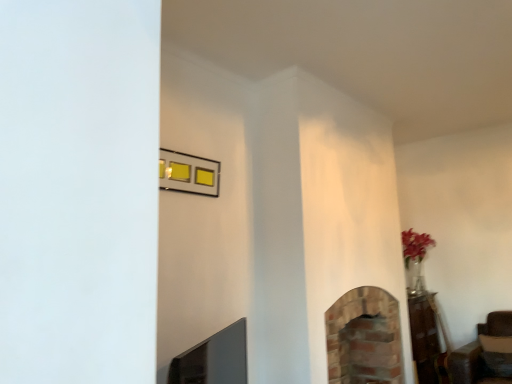
Find the location of a particular element. This screenshot has width=512, height=384. brick fireplace at center, which is the 1th fireplace from right to left is located at coordinates (364, 338).

Is brick fireplace at lower center, the first fireplace when ordered from left to right, further to camera compared to metallic gold picture frame at upper center?

That is False.

From a real-world perspective, which is physically above, brick fireplace at lower center, the second fireplace viewed from the right, or metallic gold picture frame at upper center?

From a 3D spatial view, metallic gold picture frame at upper center is above.

Is brick fireplace at lower center, the first fireplace when ordered from left to right, looking in the opposite direction of metallic gold picture frame at upper center?

brick fireplace at lower center, the first fireplace when ordered from left to right, is not turned away from metallic gold picture frame at upper center.

Which is farther, (177, 357) or (217, 171)?

The point (177, 357) is more distant.

What are the coordinates of `fireplace directly beneath the brick fireplace at lower center, positioned as the 2th fireplace in back-to-front order (from a real-world perspective)` in the screenshot? It's located at (364, 338).

Is brick fireplace at lower center, positioned as the 2th fireplace in back-to-front order, to the left or to the right of brick fireplace at center, the second fireplace in the left-to-right sequence, in the image?

brick fireplace at lower center, positioned as the 2th fireplace in back-to-front order, is positioned on brick fireplace at center, the second fireplace in the left-to-right sequence,'s left side.

Who is more distant, brick fireplace at lower center, the second fireplace viewed from the right, or brick fireplace at center, which appears as the 2th fireplace when viewed from the front?

brick fireplace at center, which appears as the 2th fireplace when viewed from the front.

From the picture: Who is bigger, brick fireplace at lower center, marked as the first fireplace in a front-to-back arrangement, or brick fireplace at center, the second fireplace in the left-to-right sequence?

With larger size is brick fireplace at center, the second fireplace in the left-to-right sequence.

Choose the correct answer: Is metallic gold picture frame at upper center inside brick fireplace at lower center, the first fireplace when ordered from left to right, or outside it?

metallic gold picture frame at upper center lies outside brick fireplace at lower center, the first fireplace when ordered from left to right.

Where is `fireplace lying in front of the metallic gold picture frame at upper center`? The width and height of the screenshot is (512, 384). fireplace lying in front of the metallic gold picture frame at upper center is located at coordinates (214, 359).

Can you confirm if metallic gold picture frame at upper center is positioned to the left of brick fireplace at lower center, positioned as the 2th fireplace in back-to-front order?

Indeed, metallic gold picture frame at upper center is positioned on the left side of brick fireplace at lower center, positioned as the 2th fireplace in back-to-front order.

In terms of height, does metallic gold picture frame at upper center look taller or shorter compared to brick fireplace at lower center, positioned as the 2th fireplace in back-to-front order?

Clearly, metallic gold picture frame at upper center is shorter compared to brick fireplace at lower center, positioned as the 2th fireplace in back-to-front order.

Can you tell me how much brick fireplace at center, the 1th fireplace viewed from the back, and metallic gold picture frame at upper center differ in facing direction?

There is a 0.127-degree angle between the facing directions of brick fireplace at center, the 1th fireplace viewed from the back, and metallic gold picture frame at upper center.

Is brick fireplace at center, the second fireplace in the left-to-right sequence, turned away from metallic gold picture frame at upper center?

No.

Is point (361, 337) farther from camera compared to point (167, 154)?

Yes, it is.

Is brick fireplace at center, the second fireplace in the left-to-right sequence, bigger or smaller than metallic gold picture frame at upper center?

In the image, brick fireplace at center, the second fireplace in the left-to-right sequence, appears to be larger than metallic gold picture frame at upper center.

From the image's perspective, is metallic gold picture frame at upper center located beneath brick fireplace at center, which appears as the 2th fireplace when viewed from the front?

Incorrect, from the image's perspective, metallic gold picture frame at upper center is higher than brick fireplace at center, which appears as the 2th fireplace when viewed from the front.

Which object is wider, metallic gold picture frame at upper center or brick fireplace at center, the second fireplace in the left-to-right sequence?

Wider between the two is brick fireplace at center, the second fireplace in the left-to-right sequence.

Could you measure the distance between metallic gold picture frame at upper center and brick fireplace at center, the 1th fireplace viewed from the back?

They are 4.66 feet apart.

From a real-world perspective, between metallic gold picture frame at upper center and brick fireplace at center, the 1th fireplace viewed from the back, who is vertically higher?

From a 3D spatial view, metallic gold picture frame at upper center is above.

Is brick fireplace at lower center, the first fireplace when ordered from left to right, surrounded by brick fireplace at center, which is the 1th fireplace from right to left?

Definitely not — brick fireplace at lower center, the first fireplace when ordered from left to right, is not inside brick fireplace at center, which is the 1th fireplace from right to left.

From the picture: Is brick fireplace at center, which appears as the 2th fireplace when viewed from the front, wider or thinner than brick fireplace at lower center, marked as the first fireplace in a front-to-back arrangement?

brick fireplace at center, which appears as the 2th fireplace when viewed from the front, is wider than brick fireplace at lower center, marked as the first fireplace in a front-to-back arrangement.

Is brick fireplace at center, the 1th fireplace viewed from the back, bigger or smaller than brick fireplace at lower center, the first fireplace when ordered from left to right?

Clearly, brick fireplace at center, the 1th fireplace viewed from the back, is larger in size than brick fireplace at lower center, the first fireplace when ordered from left to right.

From the image's perspective, is brick fireplace at center, which appears as the 2th fireplace when viewed from the front, positioned above or below brick fireplace at lower center, the first fireplace when ordered from left to right?

Clearly, from the image's perspective, brick fireplace at center, which appears as the 2th fireplace when viewed from the front, is below brick fireplace at lower center, the first fireplace when ordered from left to right.

From a real-world perspective, starting from the metallic gold picture frame at upper center, which fireplace is the 1st one below it? Please provide its 2D coordinates.

[(214, 359)]

Find the location of `fireplace located in front of the brick fireplace at center, which is the 1th fireplace from right to left`. fireplace located in front of the brick fireplace at center, which is the 1th fireplace from right to left is located at coordinates (214, 359).

Looking at the image, which one is located closer to brick fireplace at center, which is the 1th fireplace from right to left, brick fireplace at lower center, the second fireplace viewed from the right, or metallic gold picture frame at upper center?

Among the two, brick fireplace at lower center, the second fireplace viewed from the right, is located nearer to brick fireplace at center, which is the 1th fireplace from right to left.

Estimate the real-world distances between objects in this image. Which object is further from metallic gold picture frame at upper center, brick fireplace at lower center, the first fireplace when ordered from left to right, or brick fireplace at center, the 1th fireplace viewed from the back?

brick fireplace at center, the 1th fireplace viewed from the back.

Considering their positions, is metallic gold picture frame at upper center positioned further to brick fireplace at center, the second fireplace in the left-to-right sequence, than brick fireplace at lower center, positioned as the 2th fireplace in back-to-front order?

The object further to brick fireplace at center, the second fireplace in the left-to-right sequence, is metallic gold picture frame at upper center.

From the image, which object appears to be farther from brick fireplace at lower center, positioned as the 2th fireplace in back-to-front order, brick fireplace at center, which is the 1th fireplace from right to left, or metallic gold picture frame at upper center?

brick fireplace at center, which is the 1th fireplace from right to left, is positioned further to the anchor brick fireplace at lower center, positioned as the 2th fireplace in back-to-front order.

Estimate the real-world distances between objects in this image. Which object is further from brick fireplace at lower center, the second fireplace viewed from the right, metallic gold picture frame at upper center or brick fireplace at center, which is the 1th fireplace from right to left?

brick fireplace at center, which is the 1th fireplace from right to left, is further to brick fireplace at lower center, the second fireplace viewed from the right.

Considering their positions, is brick fireplace at center, which is the 1th fireplace from right to left, positioned closer to metallic gold picture frame at upper center than brick fireplace at lower center, the second fireplace viewed from the right?

Among the two, brick fireplace at lower center, the second fireplace viewed from the right, is located nearer to metallic gold picture frame at upper center.

Where is `picture frame between brick fireplace at lower center, marked as the first fireplace in a front-to-back arrangement, and brick fireplace at center, which is the 1th fireplace from right to left, in the front-back direction`? The width and height of the screenshot is (512, 384). picture frame between brick fireplace at lower center, marked as the first fireplace in a front-to-back arrangement, and brick fireplace at center, which is the 1th fireplace from right to left, in the front-back direction is located at coordinates (188, 173).